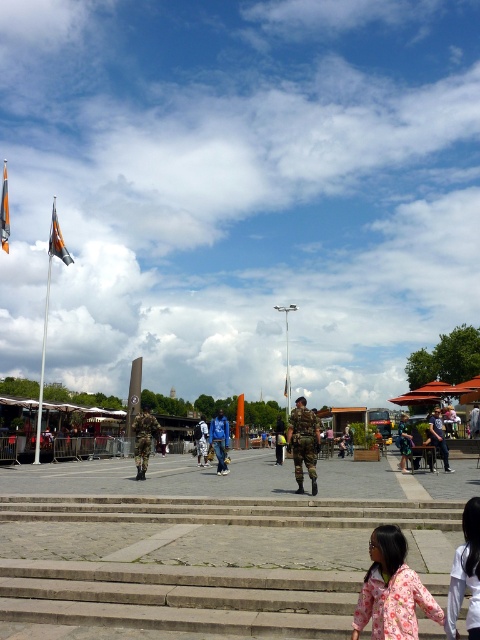
Does camouflage uniform at center have a lesser height compared to camouflage fabric soldier at center?

Correct, camouflage uniform at center is not as tall as camouflage fabric soldier at center.

Can you confirm if camouflage uniform at center is smaller than camouflage fabric soldier at center?

Yes.

The width and height of the screenshot is (480, 640). Identify the location of camouflage uniform at center. (303, 442).

Does concrete steps at center have a larger size compared to floral fabric child at lower center?

Correct, concrete steps at center is larger in size than floral fabric child at lower center.

Is point (430, 547) positioned behind point (386, 550)?

Yes, point (430, 547) is farther from viewer.

This screenshot has width=480, height=640. What are the coordinates of `concrete steps at center` in the screenshot? It's located at (208, 557).

Who is shorter, floral fabric child at lower center or camouflage fabric soldier at center?

floral fabric child at lower center

Does floral fabric child at lower center appear under camouflage fabric soldier at center?

Incorrect, floral fabric child at lower center is not positioned below camouflage fabric soldier at center.

Locate an element on the screen. The height and width of the screenshot is (640, 480). floral fabric child at lower center is located at coordinates (392, 589).